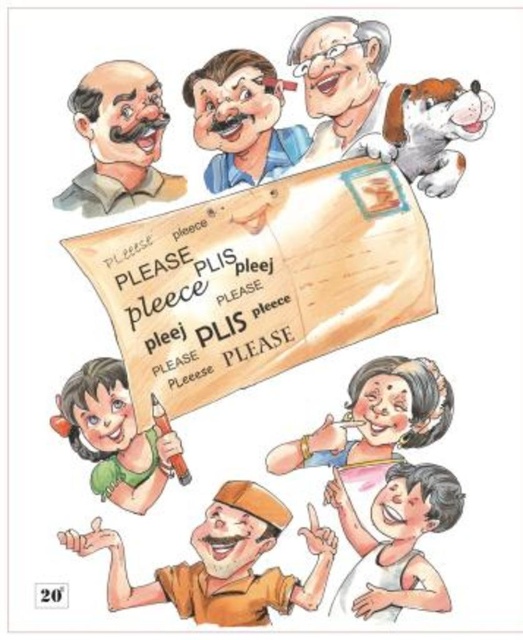
Question: Does wooden sign at center appear on the left side of brown cotton shirt at lower center?

Choices:
 (A) no
 (B) yes

Answer: (A)

Question: Which point is farther to the camera?

Choices:
 (A) matte green pencil at lower left
 (B) brown textured shirt at upper left
 (C) wooden sign at center

Answer: (C)

Question: Is wooden sign at center bigger than matte green pencil at lower left?

Choices:
 (A) no
 (B) yes

Answer: (B)

Question: Does brown cotton shirt at lower center come behind matte green pencil at lower left?

Choices:
 (A) yes
 (B) no

Answer: (B)

Question: Which of the following is the farthest from the observer?

Choices:
 (A) matte green pencil at lower left
 (B) brown textured shirt at upper left
 (C) brown cotton shirt at lower center

Answer: (A)

Question: Estimate the real-world distances between objects in this image. Which object is farther from the matte pink handbag at lower center?

Choices:
 (A) brown cotton shirt at lower center
 (B) smooth white shirt at lower right
 (C) matte green pencil at lower left

Answer: (C)